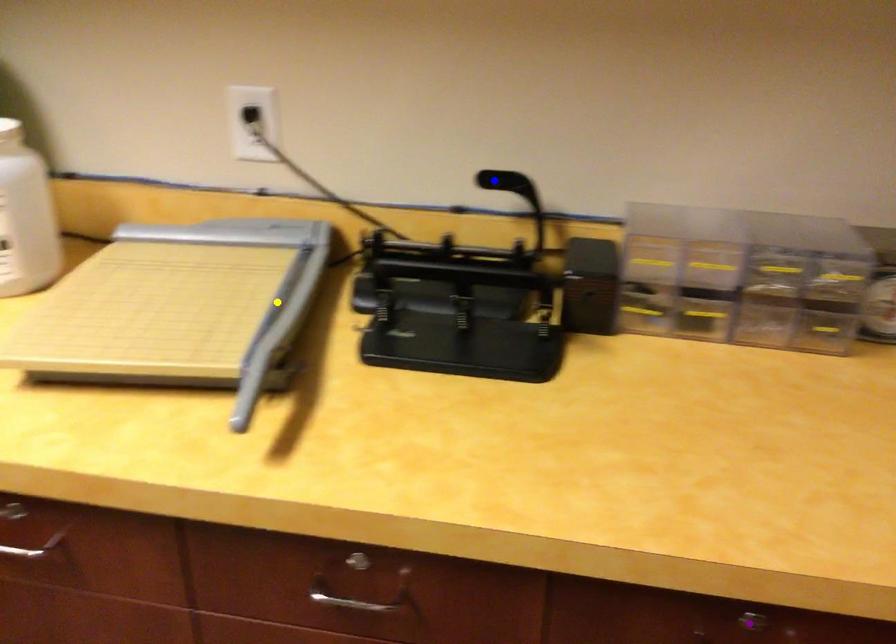
Order these from farthest to nearest:
yellow point
purple point
blue point

blue point, yellow point, purple point